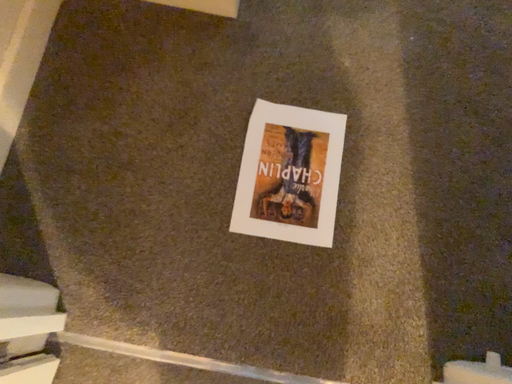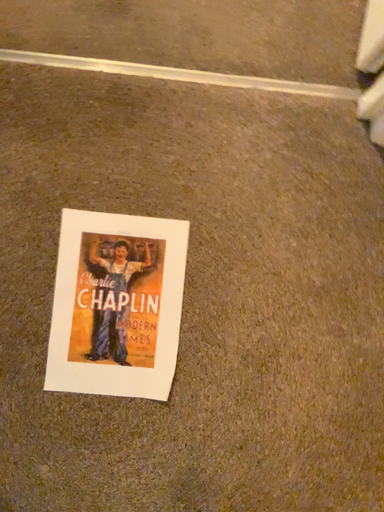
Question: Which way did the camera rotate in the video?

Choices:
 (A) rotated downward
 (B) rotated upward

Answer: (B)